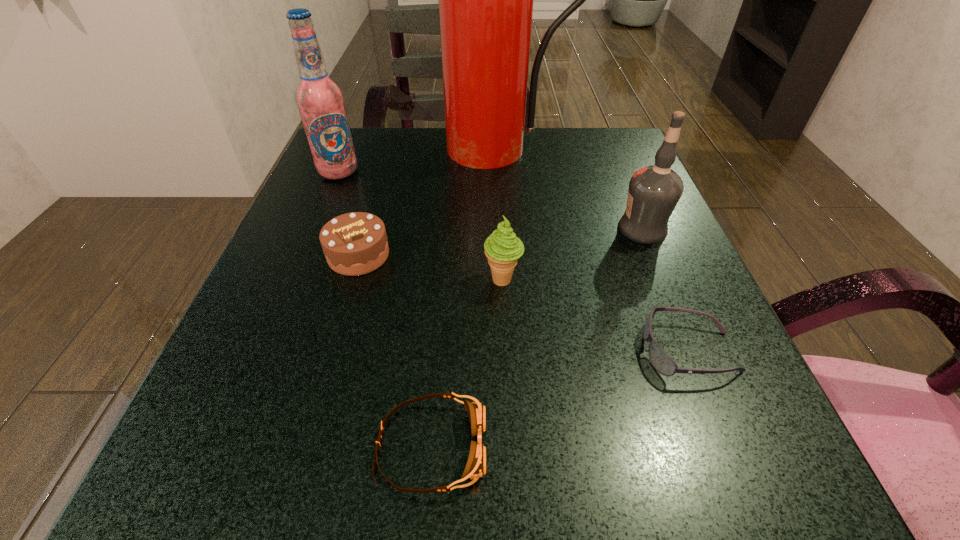
In the image, there is a desktop. At what (x,y) coordinates should I click in order to perform the action: click on vacant region at the right edge. Please return your answer as a coordinate pair (x, y). Image resolution: width=960 pixels, height=540 pixels. Looking at the image, I should click on (636, 248).

Find the location of `vacant region at the far left corner of the desktop`. vacant region at the far left corner of the desktop is located at coordinates (378, 158).

Where is `vacant space at the near left corner`? This screenshot has width=960, height=540. vacant space at the near left corner is located at coordinates (174, 496).

You are a GUI agent. You are given a task and a screenshot of the screen. Output one action in this format:
    pyautogui.click(x=<x>, y=<y>)
    Task: Click on the free space at the far right corner
    
    Given the screenshot: What is the action you would take?
    pyautogui.click(x=565, y=141)

Where is `free space at the near right corner`? free space at the near right corner is located at coordinates (791, 489).

I want to click on vacant area that lies between the fire extinguisher and the sunglasses, so click(595, 249).

The width and height of the screenshot is (960, 540). I want to click on free space between the sixth shortest object and the goggles, so click(x=385, y=309).

At what (x,y) coordinates should I click in order to perform the action: click on vacant area that lies between the third tallest object and the sunglasses. Please return your answer as a coordinate pair (x, y). This screenshot has height=540, width=960. Looking at the image, I should click on (665, 289).

This screenshot has height=540, width=960. Identify the location of free spot between the second nearest object and the goggles. (560, 399).

In order to click on free space between the goggles and the sunglasses in this screenshot , I will do `click(560, 399)`.